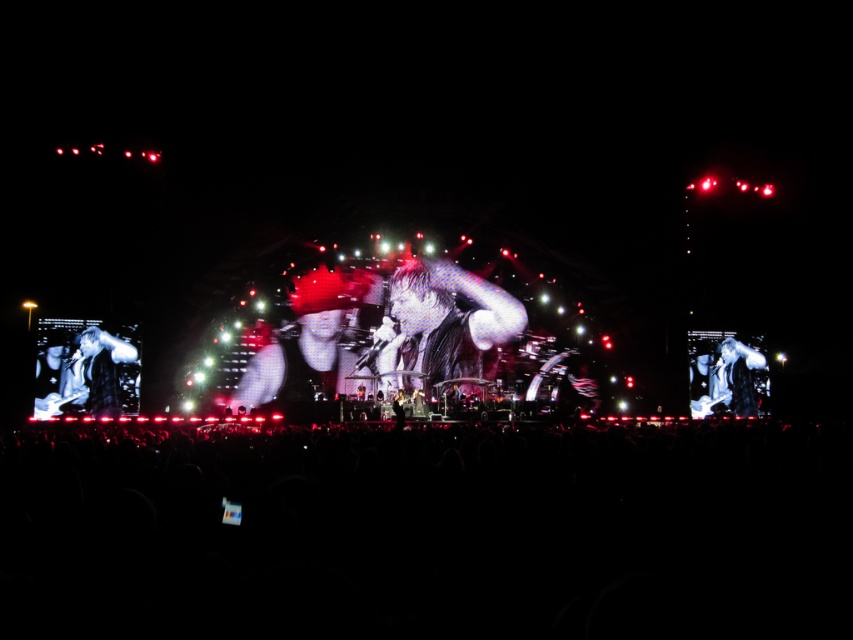
Question: Is black matte crowd at lower center wider than shiny black hair at center?

Choices:
 (A) yes
 (B) no

Answer: (A)

Question: Can you confirm if black matte crowd at lower center is thinner than shiny black leather jacket at center?

Choices:
 (A) yes
 (B) no

Answer: (B)

Question: Which of the following is the farthest from the observer?

Choices:
 (A) black matte crowd at lower center
 (B) shiny black leather jacket at center
 (C) shiny black hair at center
 (D) shiny black microphone at center

Answer: (D)

Question: Is shiny black hair at center to the left of dark hair at left from the viewer's perspective?

Choices:
 (A) yes
 (B) no

Answer: (B)

Question: Among these points, which one is nearest to the camera?

Choices:
 (A) (248, 378)
 (B) (413, 314)
 (C) (334, 621)

Answer: (C)

Question: Which point is farther from the camera taking this photo?

Choices:
 (A) (90, 369)
 (B) (801, 550)

Answer: (A)